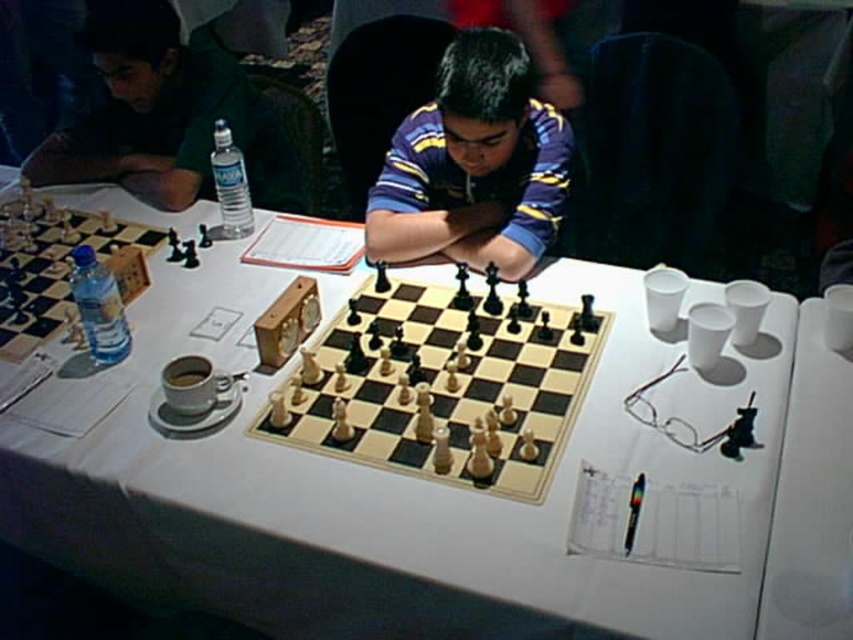
Question: Is white glossy table at center further to camera compared to matte green shirt at upper left?

Choices:
 (A) no
 (B) yes

Answer: (A)

Question: Which point is farther to the camera?

Choices:
 (A) (474, 388)
 (B) (90, 346)

Answer: (B)

Question: In this image, where is white glossy table at center located relative to striped jersey at center?

Choices:
 (A) below
 (B) above

Answer: (A)

Question: Can you confirm if wooden chess set at center is positioned below striped jersey at center?

Choices:
 (A) yes
 (B) no

Answer: (A)

Question: Among these points, which one is farthest from the camera?

Choices:
 (A) (111, 292)
 (B) (206, 81)
 (C) (396, 288)

Answer: (B)

Question: Estimate the real-world distances between objects in this image. Which object is closer to the clear plastic bottle at left?

Choices:
 (A) clear plastic bottle at center
 (B) white glossy table at center

Answer: (B)